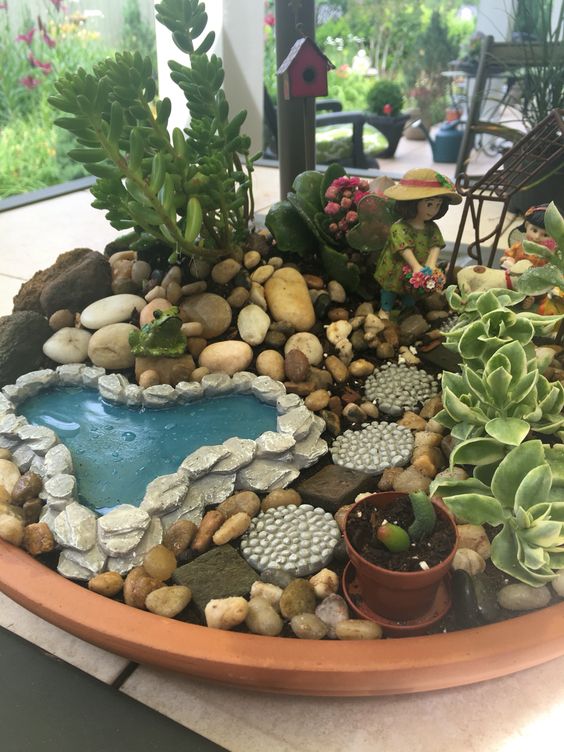
The height and width of the screenshot is (752, 564). I want to click on edge of brown pot, so click(x=333, y=647), click(x=171, y=632).